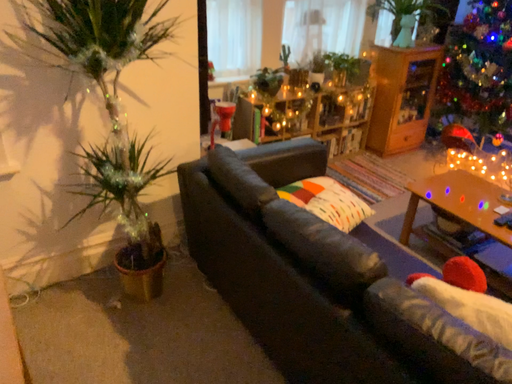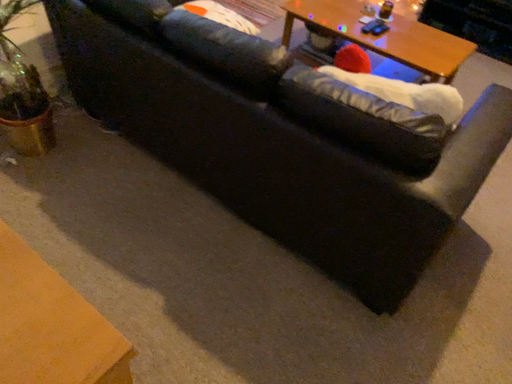
Question: How did the camera likely rotate when shooting the video?

Choices:
 (A) rotated upward
 (B) rotated downward

Answer: (B)